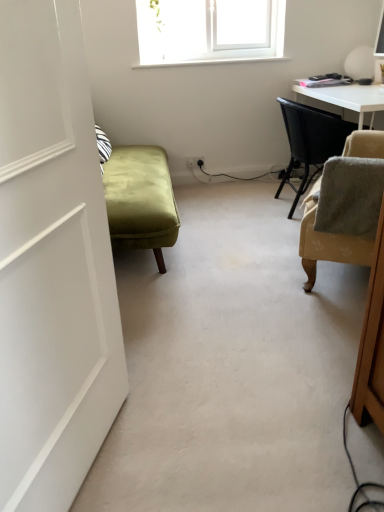
I want to click on beige fabric chair at right, which is counted as the 2th chair, starting from the back, so click(328, 243).

At what (x,y) coordinates should I click in order to perform the action: click on white matte door at left. Please return your answer as a coordinate pair (x, y). This screenshot has width=384, height=512. Looking at the image, I should click on (52, 264).

Image resolution: width=384 pixels, height=512 pixels. Identify the location of beige fabric chair at right, which is the first chair from front to back. (328, 243).

Considering the relative positions of white matte door at left and beige fabric chair at right, the 2th chair when ordered from front to back, in the image provided, is white matte door at left to the right of beige fabric chair at right, the 2th chair when ordered from front to back, from the viewer's perspective?

No, white matte door at left is not to the right of beige fabric chair at right, the 2th chair when ordered from front to back.

From a real-world perspective, which object rests below the other?

beige fabric chair at right, the 2th chair when ordered from front to back, is physically lower.

Image resolution: width=384 pixels, height=512 pixels. There is a white matte door at left. In order to click on the 2nd chair above it (from the image's perspective) in this screenshot , I will do `click(310, 141)`.

From the image's perspective, which one is positioned lower, white matte door at left or beige fabric chair at right, the 2th chair when ordered from front to back?

white matte door at left.

From a real-world perspective, which is physically above, white matte door at left or beige fabric chair at right, which is the first chair from front to back?

white matte door at left, from a real-world perspective.

Looking at this image, is white matte door at left taller or shorter than beige fabric chair at right, which is counted as the 2th chair, starting from the back?

Clearly, white matte door at left is taller compared to beige fabric chair at right, which is counted as the 2th chair, starting from the back.

Is white matte door at left not inside beige fabric chair at right, which is counted as the 2th chair, starting from the back?

Yes.

Is white matte door at left positioned far away from beige fabric chair at right, which is the first chair from front to back?

Yes, white matte door at left is far from beige fabric chair at right, which is the first chair from front to back.

Which is in front, point (358, 257) or point (78, 353)?

The point (78, 353) is closer to the camera.

Based on the photo, can you confirm if beige fabric chair at right, which is the first chair from front to back, is thinner than white matte door at left?

No, beige fabric chair at right, which is the first chair from front to back, is not thinner than white matte door at left.

Is beige fabric chair at right, which is the first chair from front to back, closer to the viewer compared to white matte door at left?

No, it is not.

Measure the distance from beige fabric chair at right, which is counted as the 2th chair, starting from the back, to beige fabric chair at right, the 2th chair when ordered from front to back.

beige fabric chair at right, which is counted as the 2th chair, starting from the back, is 98.32 centimeters from beige fabric chair at right, the 2th chair when ordered from front to back.

Can you tell me how much beige fabric chair at right, which is the first chair from front to back, and beige fabric chair at right, the first chair when ordered from back to front, differ in facing direction?

The facing directions of beige fabric chair at right, which is the first chair from front to back, and beige fabric chair at right, the first chair when ordered from back to front, are 154 degrees apart.

Consider the image. From a real-world perspective, is beige fabric chair at right, which is the first chair from front to back, located beneath beige fabric chair at right, the first chair when ordered from back to front?

No, from a real-world perspective, beige fabric chair at right, which is the first chair from front to back, is not beneath beige fabric chair at right, the first chair when ordered from back to front.

Is point (370, 242) positioned behind point (307, 174)?

No, (370, 242) is in front of (307, 174).

From the image's perspective, which is below, beige fabric chair at right, the first chair when ordered from back to front, or white matte door at left?

From the image's view, white matte door at left is below.

Between beige fabric chair at right, the 2th chair when ordered from front to back, and white matte door at left, which one is positioned in front?

white matte door at left.

Is beige fabric chair at right, the 2th chair when ordered from front to back, to the left or to the right of white matte door at left in the image?

Clearly, beige fabric chair at right, the 2th chair when ordered from front to back, is on the right of white matte door at left in the image.

Can you confirm if beige fabric chair at right, the 2th chair when ordered from front to back, is wider than white matte door at left?

Indeed, beige fabric chair at right, the 2th chair when ordered from front to back, has a greater width compared to white matte door at left.

Is beige fabric chair at right, the 2th chair when ordered from front to back, positioned in front of beige fabric chair at right, which is the first chair from front to back?

No, beige fabric chair at right, the 2th chair when ordered from front to back, is further to the viewer.

Is beige fabric chair at right, the first chair when ordered from back to front, bigger or smaller than beige fabric chair at right, which is counted as the 2th chair, starting from the back?

In the image, beige fabric chair at right, the first chair when ordered from back to front, appears to be larger than beige fabric chair at right, which is counted as the 2th chair, starting from the back.

From the image's perspective, which is below, beige fabric chair at right, the first chair when ordered from back to front, or beige fabric chair at right, which is the first chair from front to back?

beige fabric chair at right, which is the first chair from front to back, is shown below in the image.

Is point (333, 124) closer to camera compared to point (314, 254)?

No.

Locate an element on the screen. This screenshot has width=384, height=512. door on the left of beige fabric chair at right, the 2th chair when ordered from front to back is located at coordinates (52, 264).

Where is `door lying below the beige fabric chair at right, which is the first chair from front to back (from the image's perspective)`? Image resolution: width=384 pixels, height=512 pixels. door lying below the beige fabric chair at right, which is the first chair from front to back (from the image's perspective) is located at coordinates (52, 264).

Based on their spatial positions, is beige fabric chair at right, the first chair when ordered from back to front, or white matte door at left further from beige fabric chair at right, which is counted as the 2th chair, starting from the back?

white matte door at left lies further to beige fabric chair at right, which is counted as the 2th chair, starting from the back, than the other object.

Based on their spatial positions, is beige fabric chair at right, which is counted as the 2th chair, starting from the back, or white matte door at left further from beige fabric chair at right, the first chair when ordered from back to front?

white matte door at left is further to beige fabric chair at right, the first chair when ordered from back to front.

Based on their spatial positions, is beige fabric chair at right, which is counted as the 2th chair, starting from the back, or beige fabric chair at right, the 2th chair when ordered from front to back, further from white matte door at left?

Based on the image, beige fabric chair at right, the 2th chair when ordered from front to back, appears to be further to white matte door at left.

Based on their spatial positions, is white matte door at left or beige fabric chair at right, which is counted as the 2th chair, starting from the back, further from beige fabric chair at right, the first chair when ordered from back to front?

Among the two, white matte door at left is located further to beige fabric chair at right, the first chair when ordered from back to front.

When comparing their distances from white matte door at left, does beige fabric chair at right, the first chair when ordered from back to front, or beige fabric chair at right, which is the first chair from front to back, seem closer?

Among the two, beige fabric chair at right, which is the first chair from front to back, is located nearer to white matte door at left.

From the image, which object appears to be farther from beige fabric chair at right, which is counted as the 2th chair, starting from the back, white matte door at left or beige fabric chair at right, the 2th chair when ordered from front to back?

white matte door at left is further to beige fabric chair at right, which is counted as the 2th chair, starting from the back.

The width and height of the screenshot is (384, 512). Find the location of `chair between white matte door at left and beige fabric chair at right, the 2th chair when ordered from front to back, along the z-axis`. chair between white matte door at left and beige fabric chair at right, the 2th chair when ordered from front to back, along the z-axis is located at coordinates (328, 243).